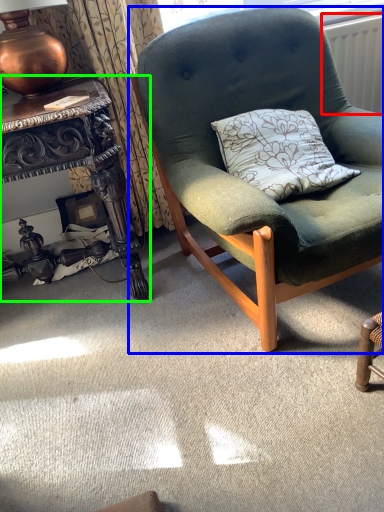
Question: Which is farther away from radiator (highlighted by a red box)? chair (highlighted by a blue box) or desk (highlighted by a green box)?

Choices:
 (A) chair
 (B) desk

Answer: (B)